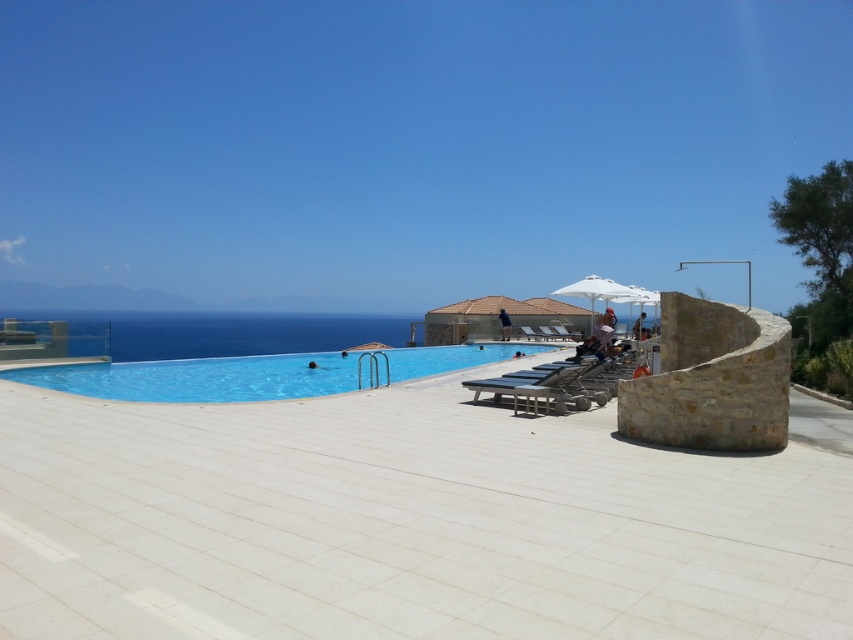
Which of these two, white fabric umbrella at center or white fabric umbrella at upper center, stands taller?

white fabric umbrella at center

Who is positioned more to the right, white fabric umbrella at center or white fabric umbrella at upper center?

white fabric umbrella at upper center is more to the right.

Is point (598, 284) positioned behind point (651, 305)?

That is False.

Identify the location of white fabric umbrella at center. Image resolution: width=853 pixels, height=640 pixels. (595, 289).

Between blue glossy pool at center and white fabric umbrella at center, which one appears on the left side from the viewer's perspective?

blue glossy pool at center

Looking at this image, can you confirm if blue glossy pool at center is thinner than white fabric umbrella at center?

Indeed, blue glossy pool at center has a lesser width compared to white fabric umbrella at center.

Is point (248, 397) closer to viewer compared to point (619, 296)?

Yes, point (248, 397) is closer to viewer.

You are a GUI agent. You are given a task and a screenshot of the screen. Output one action in this format:
    pyautogui.click(x=<x>, y=<y>)
    Task: Click on the blue glossy pool at center
    
    Given the screenshot: What is the action you would take?
    pyautogui.click(x=199, y=378)

Can you confirm if blue glossy pool at center is positioned above white fabric umbrella at upper center?

No, blue glossy pool at center is not above white fabric umbrella at upper center.

Does blue glossy pool at center appear on the right side of white fabric umbrella at upper center?

No, blue glossy pool at center is not to the right of white fabric umbrella at upper center.

Between point (309, 390) and point (643, 291), which one is positioned behind?

Positioned behind is point (643, 291).

Identify the location of blue glossy pool at center. The width and height of the screenshot is (853, 640). (199, 378).